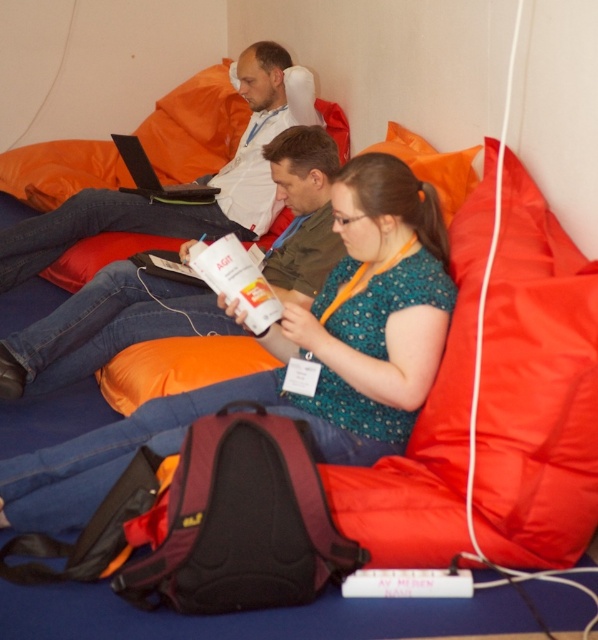
Is matte white laptop at upper left thinner than matte white laptop at upper center?

Correct, matte white laptop at upper left's width is less than matte white laptop at upper center's.

Does point (164, 291) come farther from viewer compared to point (53, 243)?

No, it is in front of (53, 243).

The image size is (598, 640). What do you see at coordinates (105, 326) in the screenshot?
I see `matte white laptop at upper left` at bounding box center [105, 326].

The width and height of the screenshot is (598, 640). What are the coordinates of `matte white laptop at upper left` in the screenshot? It's located at (105, 326).

Is point (126, 461) positioned behind point (89, 337)?

No, (126, 461) is in front of (89, 337).

Is matte green dress at center positioned in front of matte white laptop at upper left?

Yes, it is in front of matte white laptop at upper left.

Describe the element at coordinates (294, 355) in the screenshot. I see `matte green dress at center` at that location.

Locate an element on the screen. matte green dress at center is located at coordinates (294, 355).

Can you confirm if matte green dress at center is taller than matte white laptop at upper center?

No.

Does point (38, 449) come closer to viewer compared to point (276, 104)?

Yes.

Image resolution: width=598 pixels, height=640 pixels. What do you see at coordinates (294, 355) in the screenshot?
I see `matte green dress at center` at bounding box center [294, 355].

At what (x,y) coordinates should I click in order to perform the action: click on matte green dress at center. Please return your answer as a coordinate pair (x, y). Image resolution: width=598 pixels, height=640 pixels. Looking at the image, I should click on (294, 355).